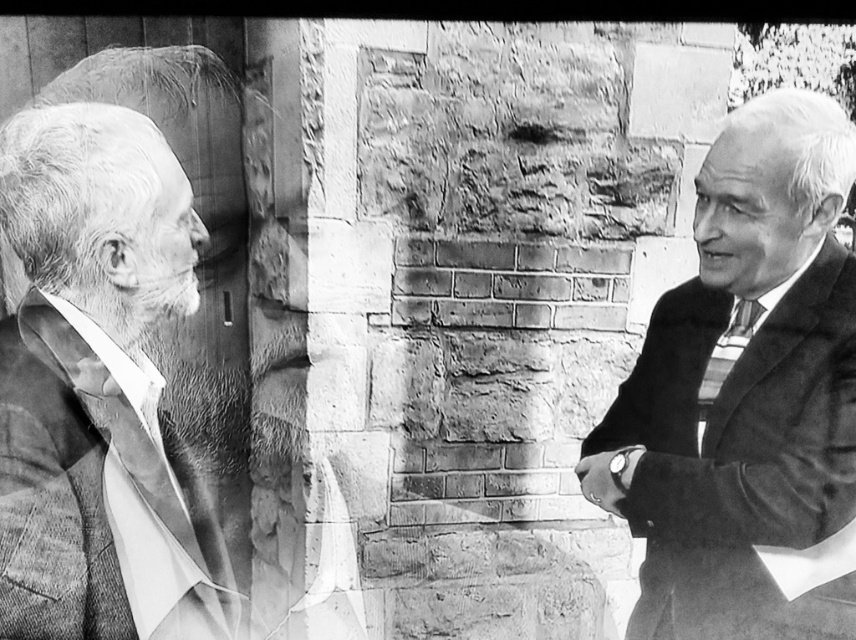
Is smooth suit jacket at right behind silky black tie at right?

No, it is in front of silky black tie at right.

Does smooth suit jacket at right appear on the left side of silky black tie at right?

Correct, you'll find smooth suit jacket at right to the left of silky black tie at right.

This screenshot has height=640, width=856. What do you see at coordinates (747, 397) in the screenshot? I see `smooth suit jacket at right` at bounding box center [747, 397].

Where is `smooth suit jacket at right`? The width and height of the screenshot is (856, 640). smooth suit jacket at right is located at coordinates (747, 397).

Who is higher up, smooth suit jacket at right or gray wool suit at left?

Positioned higher is smooth suit jacket at right.

Is point (721, 557) farther from camera compared to point (104, 470)?

Yes.

Describe the element at coordinates (747, 397) in the screenshot. I see `smooth suit jacket at right` at that location.

The height and width of the screenshot is (640, 856). What are the coordinates of `smooth suit jacket at right` in the screenshot? It's located at (747, 397).

Is gray wool suit at left positioned in front of silky black tie at right?

Yes, it is in front of silky black tie at right.

Is point (66, 289) behind point (745, 337)?

No, (66, 289) is closer to viewer.

Where is `gray wool suit at left`? gray wool suit at left is located at coordinates (94, 378).